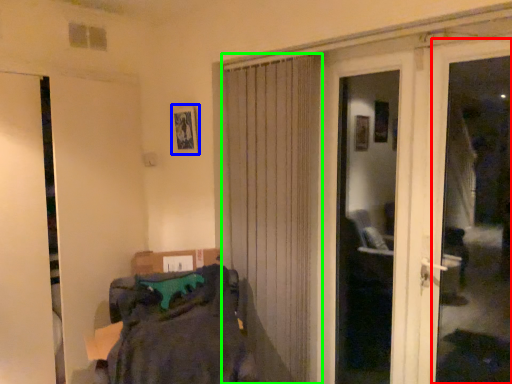
Question: Based on their relative distances, which object is nearer to window frame (highlighted by a red box)? Choose from picture frame (highlighted by a blue box) and curtain (highlighted by a green box).

Choices:
 (A) picture frame
 (B) curtain

Answer: (B)